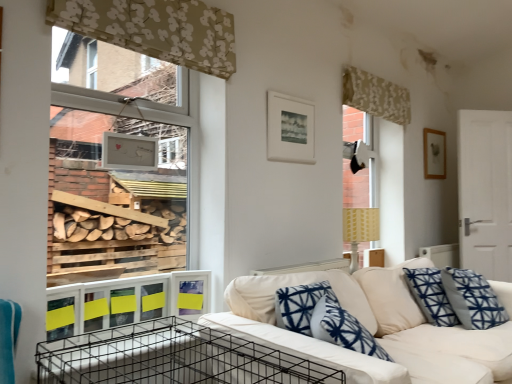
Question: Visually, is wooden picture frame at upper right, the 2th picture frame from the front, positioned to the left or to the right of patterned fabric curtain at upper right, which appears as the first curtain when viewed from the right?

Choices:
 (A) right
 (B) left

Answer: (A)

Question: Is wooden picture frame at upper right, the 2th picture frame from the front, inside the boundaries of patterned fabric curtain at upper right, which appears as the first curtain when viewed from the right, or outside?

Choices:
 (A) inside
 (B) outside

Answer: (B)

Question: Which is nearer to the yellow paper at lower left?

Choices:
 (A) black wire crate at lower left
 (B) white fabric couch at center
 (C) patterned fabric curtain at upper right, which ranks as the first curtain in back-to-front order
 (D) beige floral fabric at upper center, the 2th curtain positioned from the right
 (E) white matte picture frame at upper center, marked as the second picture frame in a right-to-left arrangement

Answer: (A)

Question: Which object is positioned farthest from the yellow paper at lower left?

Choices:
 (A) white fabric couch at center
 (B) patterned fabric curtain at upper right, which ranks as the first curtain in back-to-front order
 (C) wooden picture frame at upper right, the 1th picture frame from the back
 (D) beige floral fabric at upper center, the 2th curtain positioned from the right
 (E) black wire crate at lower left

Answer: (C)